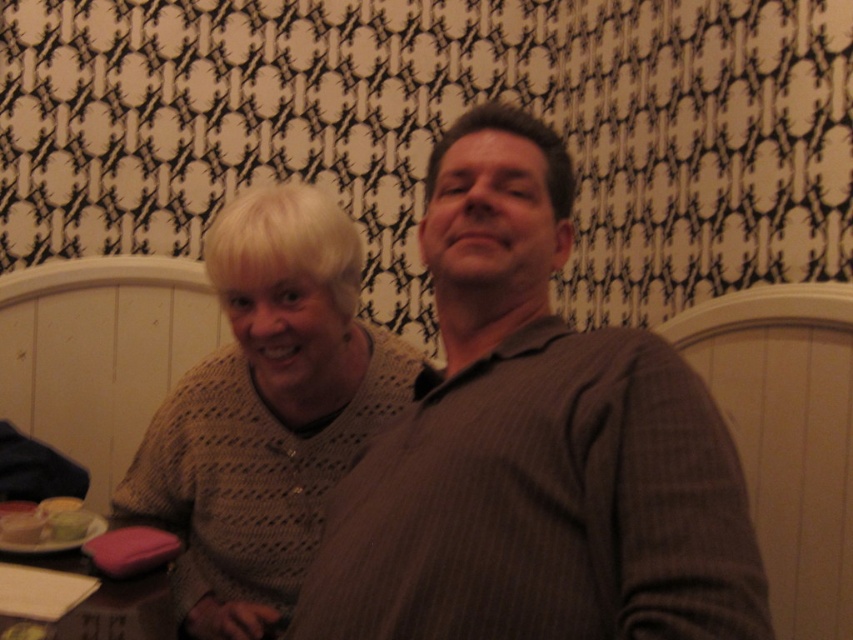
Between point (585, 573) and point (239, 624), which one is positioned in front?

Positioned in front is point (585, 573).

Does gray striped shirt at center have a greater height compared to knitted beige sweater at center?

In fact, gray striped shirt at center may be shorter than knitted beige sweater at center.

Between point (402, 432) and point (192, 513), which one is positioned in front?

Point (402, 432) is in front.

Find the location of a particular element. This screenshot has height=640, width=853. gray striped shirt at center is located at coordinates (532, 448).

Can you confirm if knitted beige sweater at center is taller than pink fabric at lower left?

Yes.

The width and height of the screenshot is (853, 640). In order to click on knitted beige sweater at center in this screenshot , I will do `click(265, 412)`.

Is point (207, 268) more distant than point (119, 580)?

That is False.

Find the location of a particular element. Image resolution: width=853 pixels, height=640 pixels. knitted beige sweater at center is located at coordinates (265, 412).

Who is positioned more to the right, gray striped shirt at center or matte plastic container at lower left?

Positioned to the right is gray striped shirt at center.

Is gray striped shirt at center bigger than matte plastic container at lower left?

Correct, gray striped shirt at center is larger in size than matte plastic container at lower left.

Does point (511, 468) lie in front of point (44, 536)?

Yes.

Identify the location of gray striped shirt at center. This screenshot has height=640, width=853. 532,448.